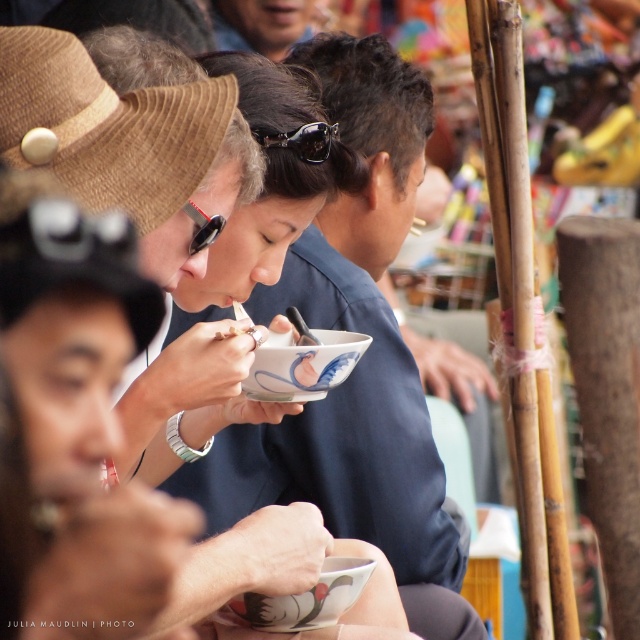
Question: Is brown corduroy hat at upper left to the left of blue fabric shirt at center from the viewer's perspective?

Choices:
 (A) yes
 (B) no

Answer: (A)

Question: Which object is positioned closest to the black rubber goggles at upper center?

Choices:
 (A) brown corduroy hat at upper left
 (B) blue fabric shirt at center

Answer: (A)

Question: Is brown corduroy hat at upper left thinner than black rubber goggles at center?

Choices:
 (A) yes
 (B) no

Answer: (B)

Question: Does brown corduroy hat at upper left have a larger size compared to black rubber goggles at upper center?

Choices:
 (A) yes
 (B) no

Answer: (A)

Question: Which point is closer to the camera?

Choices:
 (A) brown corduroy hat at upper left
 (B) black rubber goggles at center

Answer: (A)

Question: Which point is closer to the camera?

Choices:
 (A) blue fabric shirt at center
 (B) black rubber goggles at upper center
 (C) black rubber goggles at center
 (D) brown corduroy hat at upper left

Answer: (D)